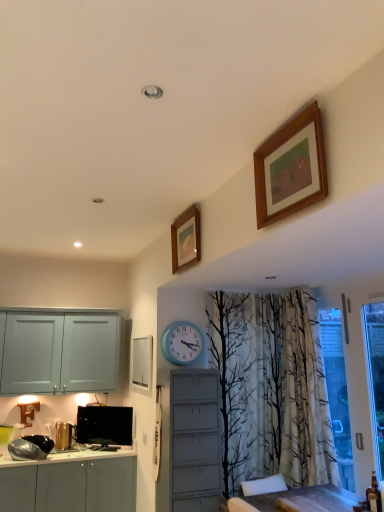
This screenshot has height=512, width=384. Find the location of `empty space that is ontop of wooden-framed painting at upper right, placed as the first picture frame when sorted from front to back`. empty space that is ontop of wooden-framed painting at upper right, placed as the first picture frame when sorted from front to back is located at coordinates (284, 126).